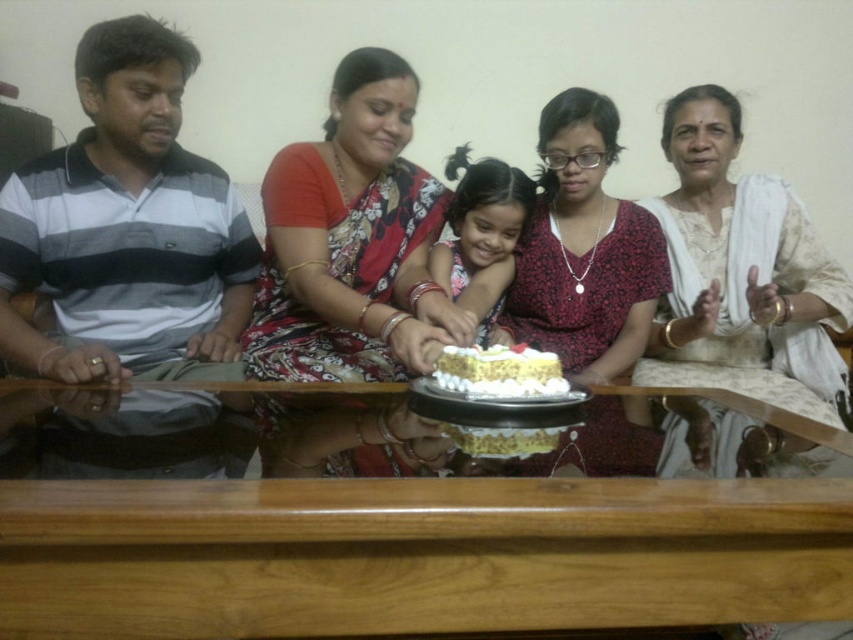
From the picture: You are a photographer standing in front of the wooden table at center where the smooth white cake at center is placed. You want to capture a photo that shows both the cake and the table clearly. Considering their heights, which one should you adjust your camera angle to focus on first?

The wooden table at center is shorter than the smooth white cake at center. To capture both clearly, you should lower your camera angle to focus on the wooden table at center first, then adjust upward to include the taller smooth white cake at center.

From the picture: In the scene described, there is a smooth white cake at center and a floral saree at center. Which object is located to the right of the other?

The smooth white cake at center is positioned on the right side of the floral saree at center.

Based on the scene description, which object is positioned lower in the image, the wooden table at center or the floral fabric dress at center?

The wooden table at center is located below the floral fabric dress at center, so the wooden table at center is positioned lower in the image.